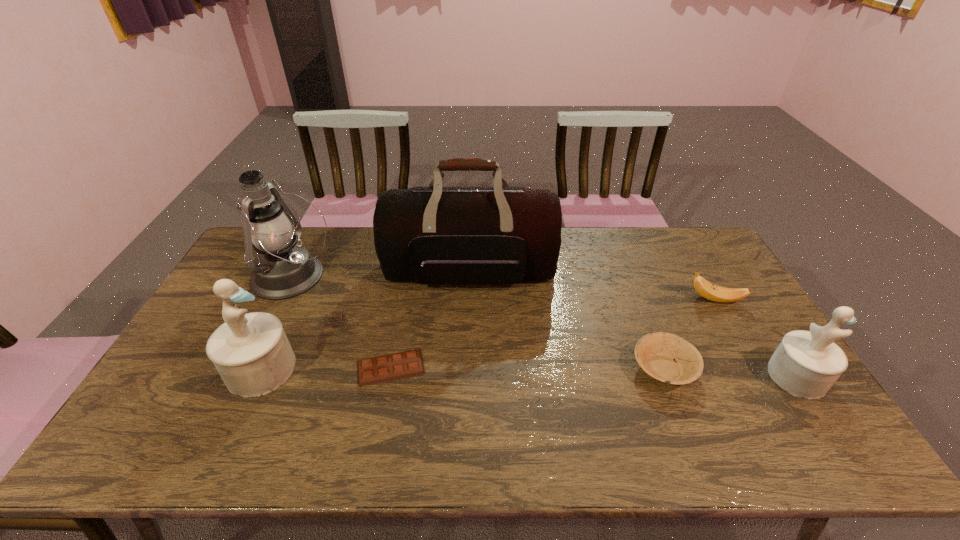
In order to click on vacant space located at the beak of the third tallest object in this screenshot , I will do `click(331, 369)`.

This screenshot has height=540, width=960. What are the coordinates of `vacant region located on the front pocket of the duffel bag` in the screenshot? It's located at (468, 338).

Where is `free space located on the left of the fifth tallest object`? free space located on the left of the fifth tallest object is located at coordinates (631, 299).

The height and width of the screenshot is (540, 960). Identify the location of vacant region located 0.150m on the right of the oil lamp. (378, 278).

Identify the location of vacant area situated 0.240m on the right of the chocolate bar. The height and width of the screenshot is (540, 960). (515, 367).

I want to click on free space located 0.090m on the back of the third object from right to left, so click(645, 321).

Locate an element on the screen. duffel bag positioned at the far edge is located at coordinates (429, 235).

Where is `oil lamp at the far edge`? oil lamp at the far edge is located at coordinates (282, 270).

Find the location of a particular element. The width and height of the screenshot is (960, 540). bowl at the near edge is located at coordinates (655, 353).

The image size is (960, 540). I want to click on figurine located at the left edge, so click(251, 352).